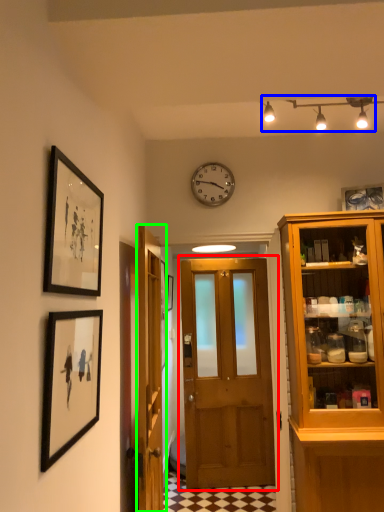
Question: Which object is the farthest from door (highlighted by a red box)? Choose among these: light fixture (highlighted by a blue box) or door (highlighted by a green box).

Choices:
 (A) light fixture
 (B) door

Answer: (A)